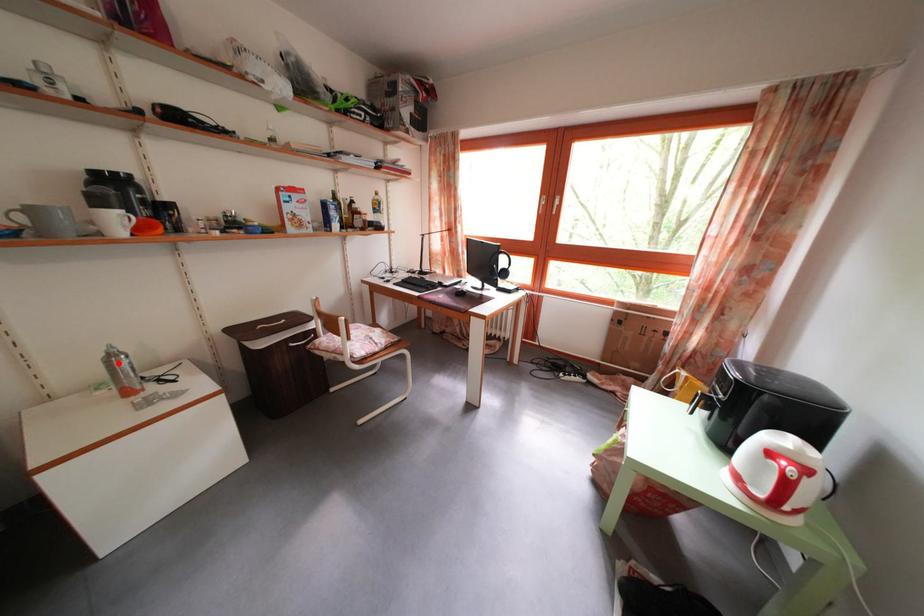
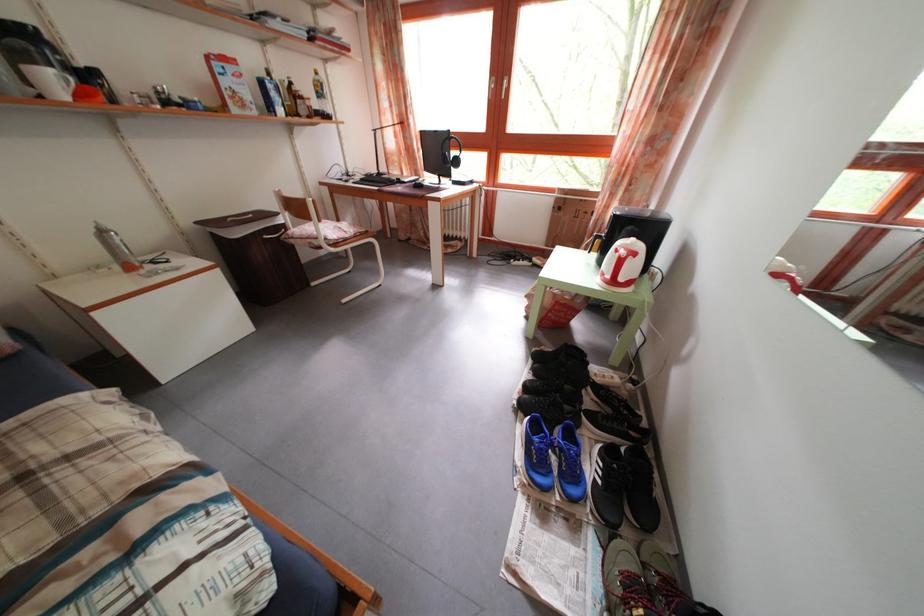
Question: A red point is marked in image1. In image2, is the corresponding 3D point closer to the camera or farther? Reply with the corresponding letter.

Choices:
 (A) The corresponding 3D point is closer.
 (B) The corresponding 3D point is farther.

Answer: (B)